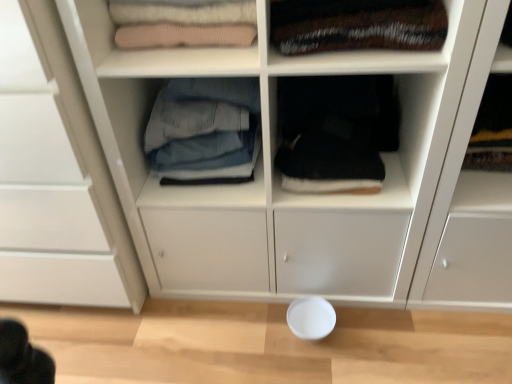
Find the location of a particular element. space that is in front of white matte bowl at lower center is located at coordinates (320, 365).